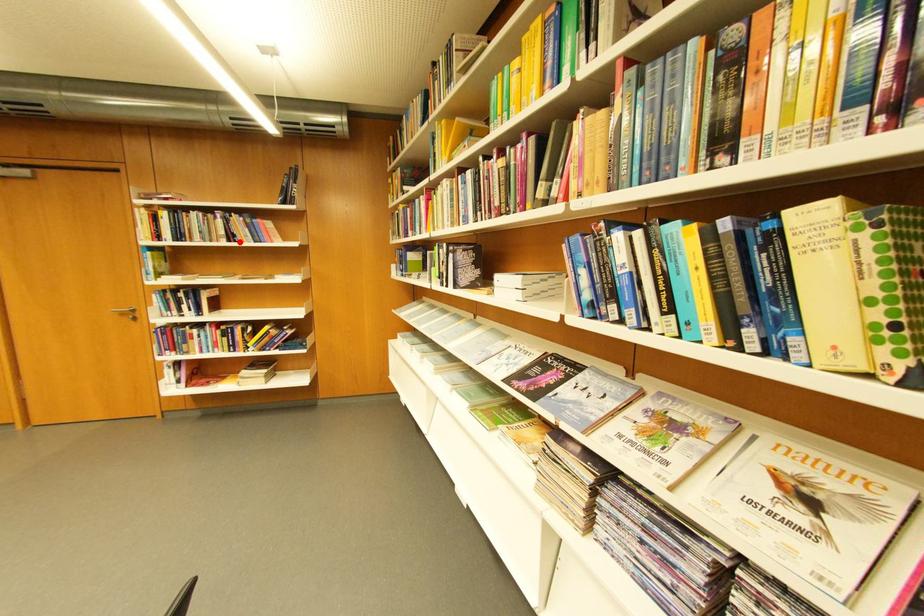
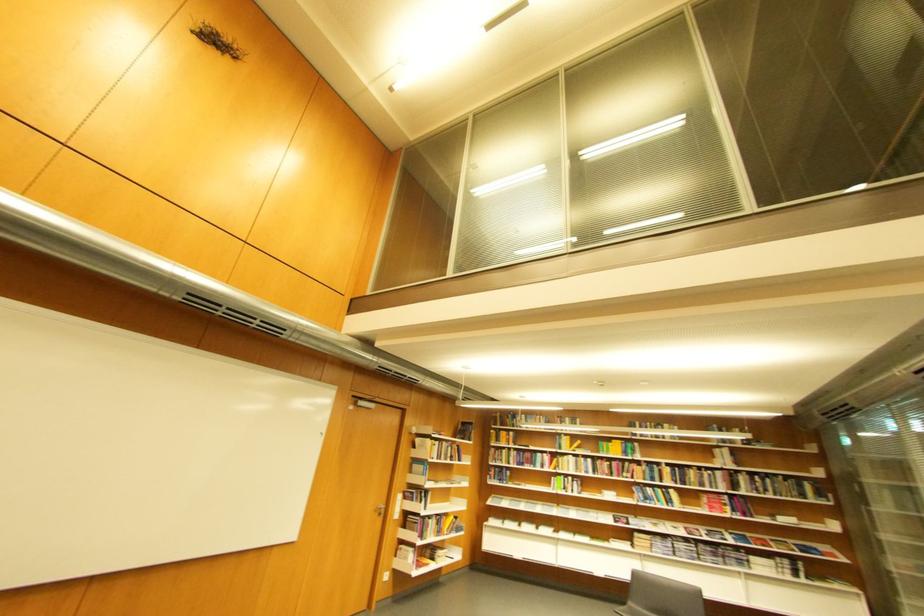
Question: A red point is marked in image1. In image2, is the corresponding 3D point closer to the camera or farther? Reply with the corresponding letter.

Choices:
 (A) The corresponding 3D point is closer.
 (B) The corresponding 3D point is farther.

Answer: (B)